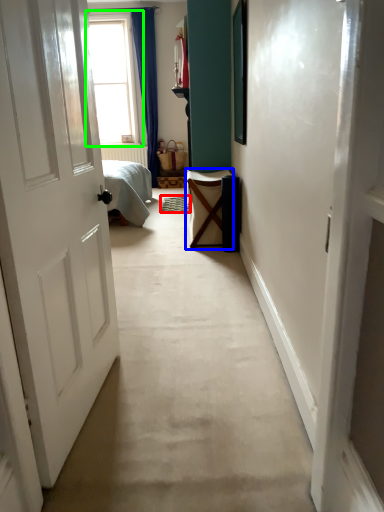
Question: Which object is the farthest from doormat (highlighted by a red box)? Choose among these: furniture (highlighted by a blue box) or window (highlighted by a green box).

Choices:
 (A) furniture
 (B) window

Answer: (B)